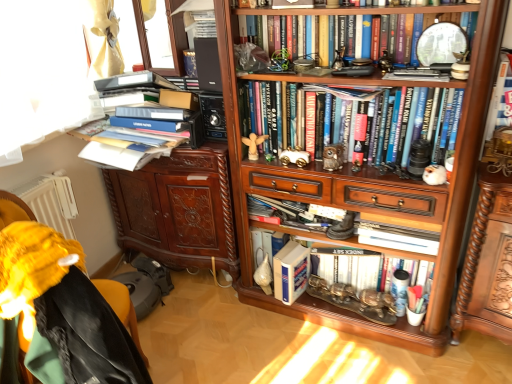
At what (x,y) coordinates should I click in order to perform the action: click on vacant point above hardcover book at upper center, which is the fifth book in bottom-to-top order (from a real-world perspective). Please return your answer as a coordinate pair (x, y). This screenshot has width=512, height=384. Looking at the image, I should click on [x=355, y=8].